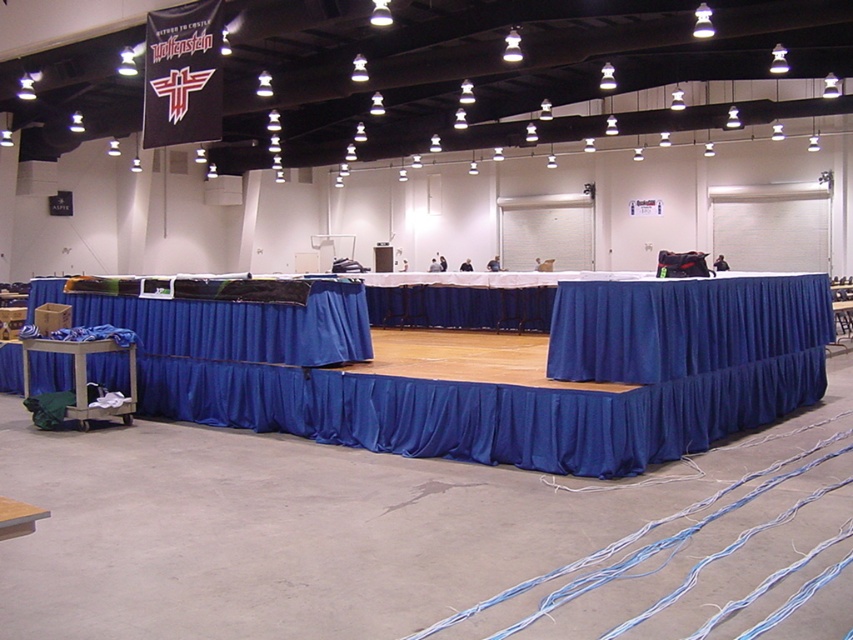
Is blue fabric tablecloth at left positioned in front of green fabric cart at lower left?

Yes.

Does blue fabric tablecloth at left have a lesser width compared to green fabric cart at lower left?

In fact, blue fabric tablecloth at left might be wider than green fabric cart at lower left.

Does point (345, 330) lie in front of point (25, 374)?

Yes, it is.

Locate an element on the screen. The height and width of the screenshot is (640, 853). blue fabric tablecloth at left is located at coordinates (231, 324).